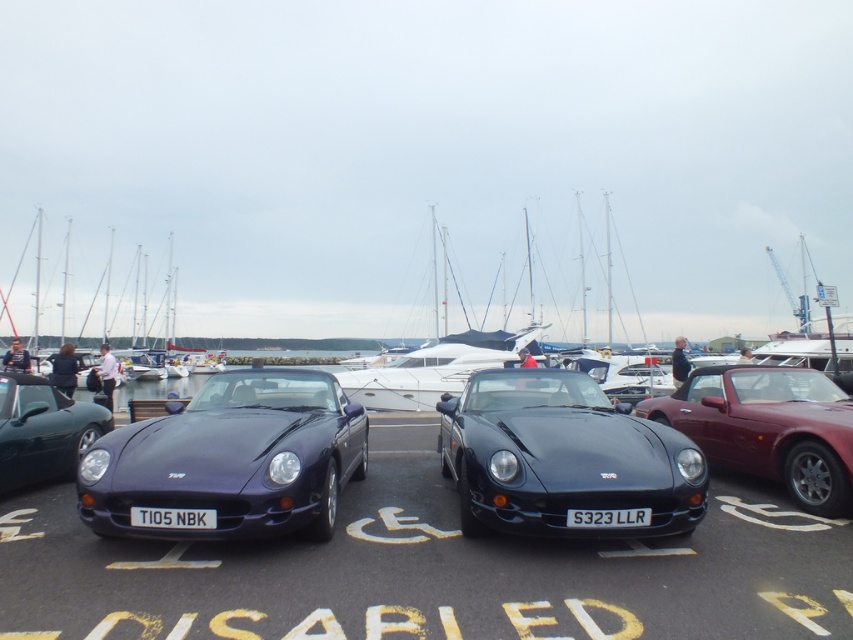
You are standing at the marina and want to locate two specific points in the image. The first point, point (51, 532), and the second point, point (514, 349). Which of these two points is closer to you?

Point (51, 532) is closer to the viewer than point (514, 349).

You are a pedestrian walking along the dock and notice two cars parked in front of you. The cars are the matte black car at center and the shiny maroon convertible at center. Which car is closer to you?

The matte black car at center is closer to you because it is in front of the shiny maroon convertible at center.

You are a parking attendant at the marina and need to locate the matte black sports car at center. According to the parking grid coordinates, where exactly is it positioned?

The matte black sports car at center is positioned at the 2D location coordinates of point (231, 458).